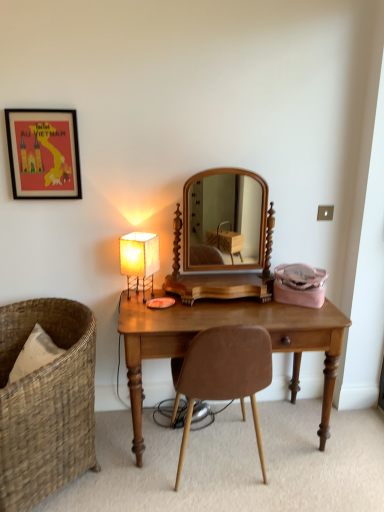
Identify the location of free space to the left of brown leather chair at center, which ranks as the 1th chair in right-to-left order. The height and width of the screenshot is (512, 384). (135, 472).